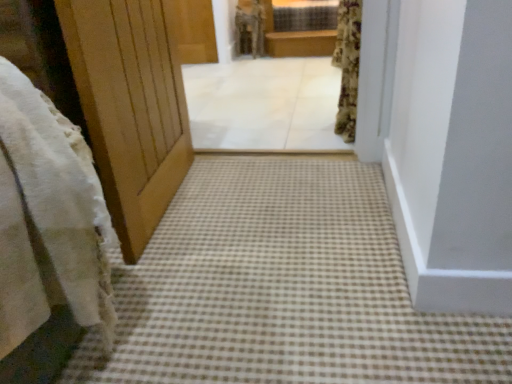
Question: Is brown checkered carpet at center at the left side of white tile floor at center?

Choices:
 (A) no
 (B) yes

Answer: (A)

Question: Is brown checkered carpet at center closer to the viewer compared to white tile floor at center?

Choices:
 (A) yes
 (B) no

Answer: (A)

Question: Does brown checkered carpet at center have a smaller size compared to white tile floor at center?

Choices:
 (A) yes
 (B) no

Answer: (A)

Question: Are brown checkered carpet at center and white tile floor at center far apart?

Choices:
 (A) yes
 (B) no

Answer: (A)

Question: From a real-world perspective, is brown checkered carpet at center over white tile floor at center?

Choices:
 (A) no
 (B) yes

Answer: (A)

Question: Is white fluffy robe at upper center spatially inside brown wooden balustrade at upper center, or outside of it?

Choices:
 (A) outside
 (B) inside

Answer: (A)

Question: From the image's perspective, is white fluffy robe at upper center above or below brown wooden balustrade at upper center?

Choices:
 (A) below
 (B) above

Answer: (B)

Question: Is white fluffy robe at upper center in front of or behind brown wooden balustrade at upper center in the image?

Choices:
 (A) front
 (B) behind

Answer: (A)

Question: Based on their sizes in the image, would you say white fluffy robe at upper center is bigger or smaller than brown wooden balustrade at upper center?

Choices:
 (A) big
 (B) small

Answer: (B)

Question: Is fluffy floral curtain at upper right taller or shorter than white tile floor at center?

Choices:
 (A) tall
 (B) short

Answer: (A)

Question: In the image, is fluffy floral curtain at upper right positioned in front of or behind white tile floor at center?

Choices:
 (A) front
 (B) behind

Answer: (A)

Question: Based on their positions, is fluffy floral curtain at upper right located to the left or right of white tile floor at center?

Choices:
 (A) left
 (B) right

Answer: (B)

Question: From a real-world perspective, is fluffy floral curtain at upper right physically located above or below white tile floor at center?

Choices:
 (A) below
 (B) above

Answer: (B)

Question: Choose the correct answer: Is brown wooden balustrade at upper center inside fluffy floral curtain at upper right or outside it?

Choices:
 (A) inside
 (B) outside

Answer: (B)

Question: Is brown wooden balustrade at upper center bigger or smaller than fluffy floral curtain at upper right?

Choices:
 (A) big
 (B) small

Answer: (B)